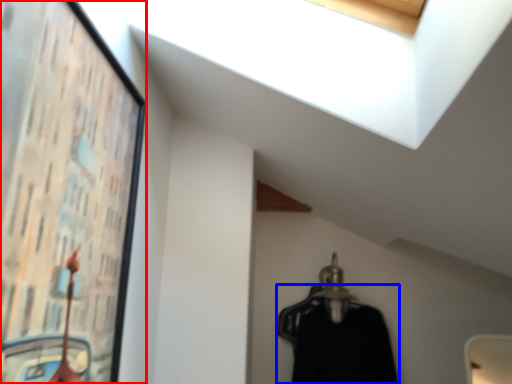
Question: Which object appears farthest to the camera in this image, picture frame (highlighted by a red box) or clothing (highlighted by a blue box)?

Choices:
 (A) picture frame
 (B) clothing

Answer: (B)